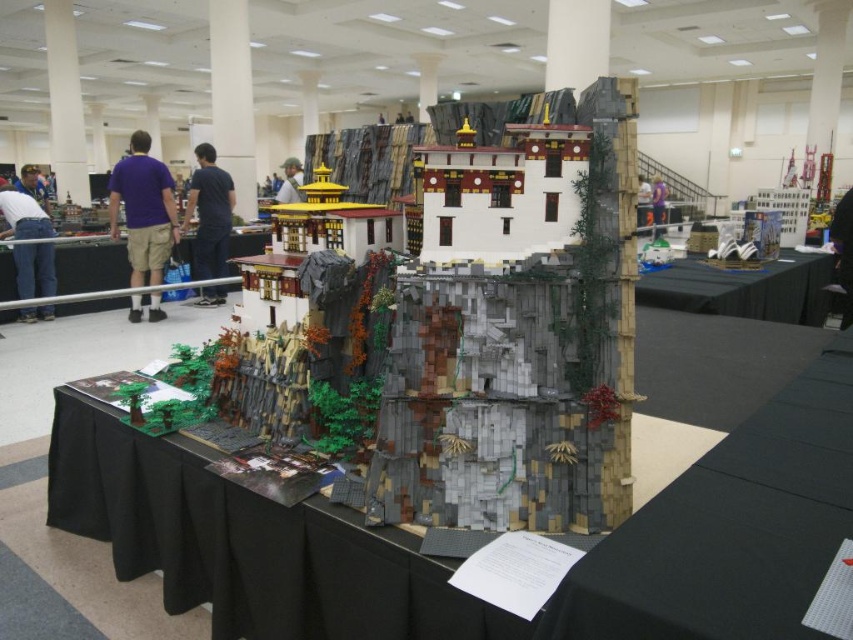
Can you confirm if black plastic table at center is taller than green fabric shirt at center?

In fact, black plastic table at center may be shorter than green fabric shirt at center.

Does point (90, 243) come in front of point (291, 173)?

Yes, point (90, 243) is in front of point (291, 173).

Is point (125, 260) positioned behind point (294, 170)?

No, it is not.

Where is `black plastic table at center`? The width and height of the screenshot is (853, 640). black plastic table at center is located at coordinates (90, 266).

Does green fabric shirt at center have a greater width compared to purple fabric at center?

Yes.

Between green fabric shirt at center and purple fabric at center, which one is positioned lower?

purple fabric at center is lower down.

Does point (302, 198) come closer to viewer compared to point (653, 216)?

Yes.

The height and width of the screenshot is (640, 853). What are the coordinates of `green fabric shirt at center` in the screenshot? It's located at (289, 180).

Does purple cotton shirt at left have a lesser height compared to green fabric shirt at center?

Yes, purple cotton shirt at left is shorter than green fabric shirt at center.

Is purple cotton shirt at left bigger than green fabric shirt at center?

No, purple cotton shirt at left is not bigger than green fabric shirt at center.

Is point (111, 212) positioned after point (283, 176)?

No, (111, 212) is in front of (283, 176).

This screenshot has height=640, width=853. In order to click on purple cotton shirt at left in this screenshot , I will do `click(143, 209)`.